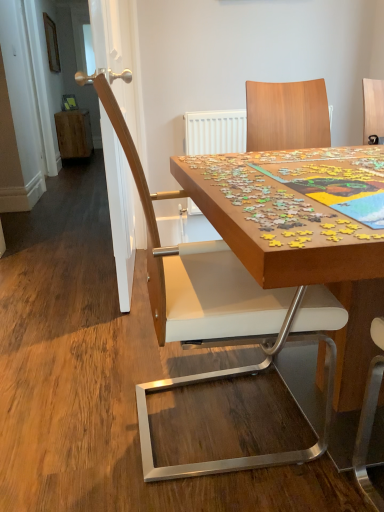
Describe the element at coordinates (205, 318) in the screenshot. I see `white leather chair at left` at that location.

I want to click on white leather chair at left, so click(x=205, y=318).

Identify the location of white leather chair at left. (205, 318).